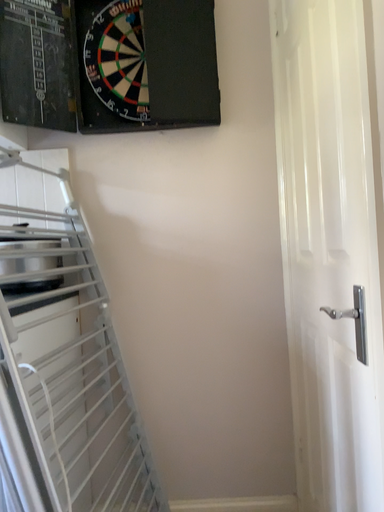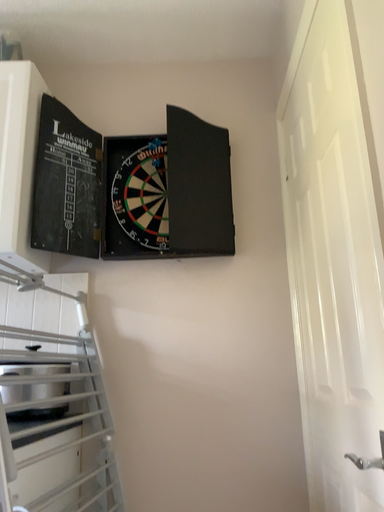
Question: How did the camera likely rotate when shooting the video?

Choices:
 (A) rotated downward
 (B) rotated upward

Answer: (B)